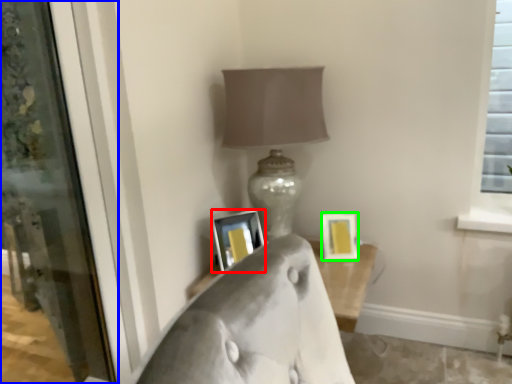
Question: Which object is the farthest from picture frame (highlighted by a red box)? Choose among these: screen door (highlighted by a blue box) or picture frame (highlighted by a green box).

Choices:
 (A) screen door
 (B) picture frame

Answer: (A)